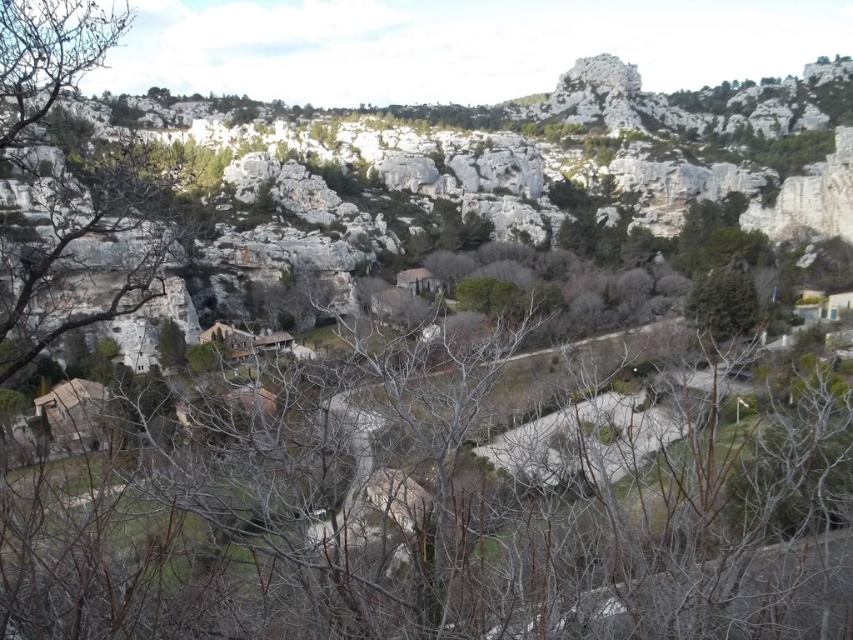
You are standing at the camera position looking at the scenic landscape. There is a point marked at coordinates point [505,496]. Can you walk to that point from your current position? Explain your reasoning based on the distance provided.

The point [505,496] is 253.18 feet away from the camera. Since this distance is walkable, you can walk to that point from your current position.

You are standing at the point marked by the coordinates point (x=440, y=515) in the image. What do you see directly in front of you?

You see brown leafless branches at center directly in front of you at point (x=440, y=515).

You are standing at the bottom of the scene and want to look at the brown leafless branches at center. In which direction should you move your gaze to locate them?

The brown leafless branches at center are located at point (440, 515) in 2D coordinates. Since you are at the bottom, you should look upward to locate them.